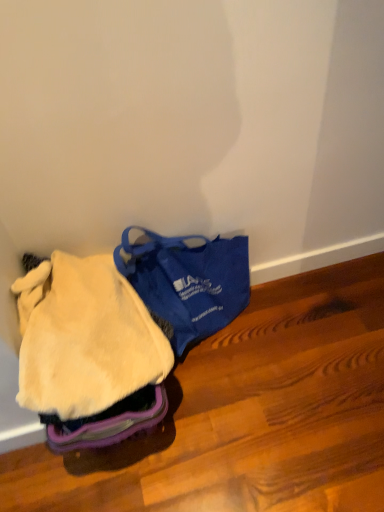
Measure the distance between blue fabric bag at center and camera.

1.15 meters.

You are a GUI agent. You are given a task and a screenshot of the screen. Output one action in this format:
    pyautogui.click(x=<x>, y=<y>)
    Task: Click on the blue fabric bag at center
    
    Given the screenshot: What is the action you would take?
    187,282

This screenshot has width=384, height=512. What do you see at coordinates (187, 282) in the screenshot?
I see `blue fabric bag at center` at bounding box center [187, 282].

Measure the distance between point (204, 256) and camera.

The distance of point (204, 256) from camera is 4.02 feet.

Identify the location of fuzzy yellow blanket at lower left. Image resolution: width=384 pixels, height=512 pixels. (84, 338).

Describe the element at coordinates (84, 338) in the screenshot. I see `fuzzy yellow blanket at lower left` at that location.

I want to click on blue fabric bag at center, so click(187, 282).

Can you confirm if blue fabric bag at center is positioned to the right of fuzzy yellow blanket at lower left?

Correct, you'll find blue fabric bag at center to the right of fuzzy yellow blanket at lower left.

Which object is further away from the camera taking this photo, blue fabric bag at center or fuzzy yellow blanket at lower left?

blue fabric bag at center is further away from the camera.

Does point (243, 283) come farther from viewer compared to point (128, 345)?

That is True.

From the image's perspective, would you say blue fabric bag at center is positioned over fuzzy yellow blanket at lower left?

Correct, blue fabric bag at center appears higher than fuzzy yellow blanket at lower left in the image.

From a real-world perspective, is blue fabric bag at center over fuzzy yellow blanket at lower left?

No, from a real-world perspective, blue fabric bag at center is not over fuzzy yellow blanket at lower left

Considering the sizes of objects blue fabric bag at center and fuzzy yellow blanket at lower left in the image provided, who is wider, blue fabric bag at center or fuzzy yellow blanket at lower left?

Wider between the two is fuzzy yellow blanket at lower left.

Between blue fabric bag at center and fuzzy yellow blanket at lower left, which one has less height?

With less height is fuzzy yellow blanket at lower left.

Looking at this image, considering the sizes of objects blue fabric bag at center and fuzzy yellow blanket at lower left in the image provided, who is smaller, blue fabric bag at center or fuzzy yellow blanket at lower left?

fuzzy yellow blanket at lower left.

In the scene shown: Is blue fabric bag at center not inside fuzzy yellow blanket at lower left?

Yes, blue fabric bag at center is outside of fuzzy yellow blanket at lower left.

Is the surface of blue fabric bag at center in direct contact with fuzzy yellow blanket at lower left?

No, blue fabric bag at center is not next to fuzzy yellow blanket at lower left.

Is blue fabric bag at center turned away from fuzzy yellow blanket at lower left?

blue fabric bag at center is not turned away from fuzzy yellow blanket at lower left.

Consider the image. How many degrees apart are the facing directions of blue fabric bag at center and fuzzy yellow blanket at lower left?

The angular difference between blue fabric bag at center and fuzzy yellow blanket at lower left is 0.000792 degrees.

Where is `clothing located on the left of blue fabric bag at center`? The width and height of the screenshot is (384, 512). clothing located on the left of blue fabric bag at center is located at coordinates click(84, 338).

In the scene shown: Can you confirm if fuzzy yellow blanket at lower left is positioned to the right of blue fabric bag at center?

In fact, fuzzy yellow blanket at lower left is to the left of blue fabric bag at center.

Is fuzzy yellow blanket at lower left positioned in front of blue fabric bag at center?

Yes, fuzzy yellow blanket at lower left is closer to the camera.

Between point (76, 343) and point (189, 288), which one is positioned in front?

Positioned in front is point (76, 343).

From the image's perspective, is fuzzy yellow blanket at lower left below blue fabric bag at center?

Yes, from the image's perspective, fuzzy yellow blanket at lower left is beneath blue fabric bag at center.

From a real-world perspective, who is located lower, fuzzy yellow blanket at lower left or blue fabric bag at center?

In real-world perspective, blue fabric bag at center is lower.

Considering the relative sizes of fuzzy yellow blanket at lower left and blue fabric bag at center in the image provided, is fuzzy yellow blanket at lower left thinner than blue fabric bag at center?

No.

Considering the sizes of objects fuzzy yellow blanket at lower left and blue fabric bag at center in the image provided, who is shorter, fuzzy yellow blanket at lower left or blue fabric bag at center?

Standing shorter between the two is fuzzy yellow blanket at lower left.

Which of these two, fuzzy yellow blanket at lower left or blue fabric bag at center, is bigger?

With larger size is blue fabric bag at center.

Is fuzzy yellow blanket at lower left inside the boundaries of blue fabric bag at center, or outside?

fuzzy yellow blanket at lower left cannot be found inside blue fabric bag at center.

Is fuzzy yellow blanket at lower left far away from blue fabric bag at center?

No.

Is fuzzy yellow blanket at lower left looking in the opposite direction of blue fabric bag at center?

That's not correct — fuzzy yellow blanket at lower left is not looking away from blue fabric bag at center.

What's the angular difference between fuzzy yellow blanket at lower left and blue fabric bag at center's facing directions?

The facing directions of fuzzy yellow blanket at lower left and blue fabric bag at center are 0.000792 degrees apart.

How distant is fuzzy yellow blanket at lower left from blue fabric bag at center?

fuzzy yellow blanket at lower left is 9.49 inches from blue fabric bag at center.

Identify the location of luggage and bags to the right of fuzzy yellow blanket at lower left. (187, 282).

What are the coordinates of `clothing that appears below the blue fabric bag at center (from the image's perspective)` in the screenshot? It's located at (84, 338).

The height and width of the screenshot is (512, 384). In order to click on clothing on the left of blue fabric bag at center in this screenshot , I will do `click(84, 338)`.